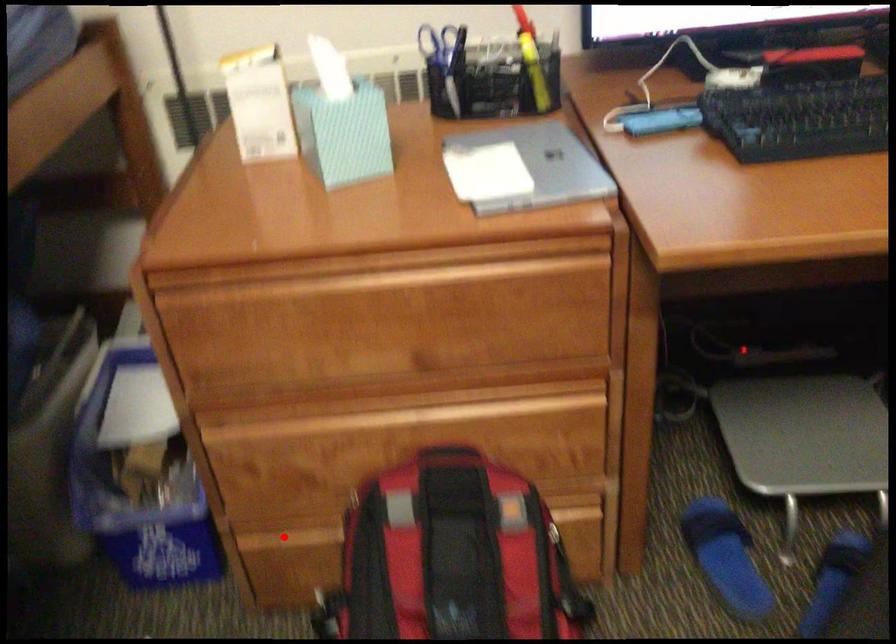
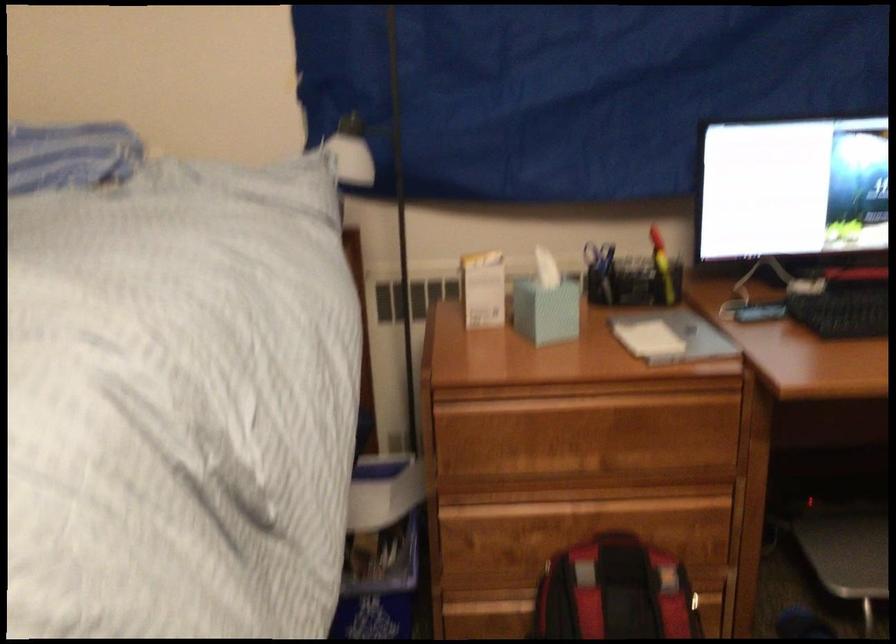
Locate, in the second image, the point that corresponds to the highlighted location in the first image.

(478, 601)